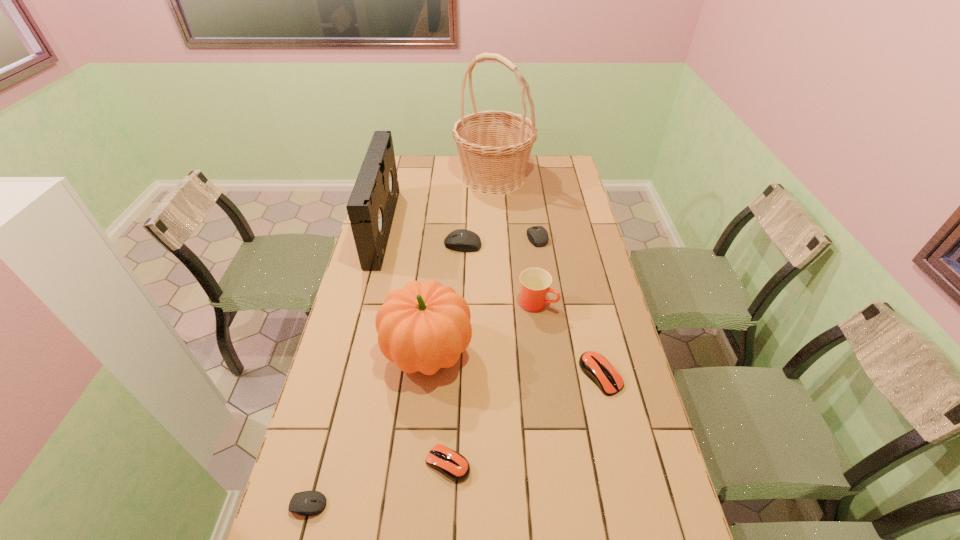
Where is `vacant space positioned on the left of the fifth nearest object`? The image size is (960, 540). vacant space positioned on the left of the fifth nearest object is located at coordinates (470, 303).

Image resolution: width=960 pixels, height=540 pixels. In order to click on free region located on the front of the fifth shortest object in this screenshot , I will do point(460,315).

The height and width of the screenshot is (540, 960). Find the location of `blank space located on the left of the rightmost computer equipment`. blank space located on the left of the rightmost computer equipment is located at coordinates (540, 375).

Find the location of a particular element. The image size is (960, 540). vacant area situated on the back of the second biggest black computer equipment is located at coordinates (529, 182).

What are the coordinates of `vacant region located on the left of the eighth farthest object` in the screenshot? It's located at (351, 463).

This screenshot has height=540, width=960. I want to click on vacant region located 0.150m on the right of the nearest black computer equipment, so click(x=390, y=504).

At what (x,y) coordinates should I click in order to perform the action: click on object situated at the far edge. Please return your answer as a coordinate pair (x, y). This screenshot has height=540, width=960. Looking at the image, I should click on (494, 147).

Identify the location of videotape situated at the left edge. (371, 207).

Where is `pumpkin located at the left edge`? The height and width of the screenshot is (540, 960). pumpkin located at the left edge is located at coordinates (423, 327).

Where is `computer equipment situated at the left edge`? computer equipment situated at the left edge is located at coordinates (306, 503).